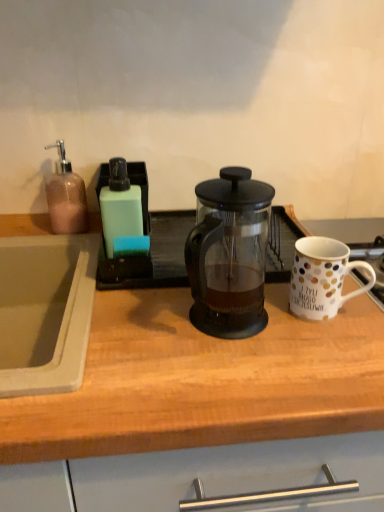
Question: Is white polka dot ceramic mug at right bigger or smaller than transparent glass french press at center?

Choices:
 (A) small
 (B) big

Answer: (A)

Question: In the image, is white polka dot ceramic mug at right positioned in front of or behind transparent glass french press at center?

Choices:
 (A) behind
 (B) front

Answer: (A)

Question: Considering the real-world distances, which object is farthest from the transparent glass french press at center?

Choices:
 (A) white polka dot ceramic mug at right
 (B) transparent glass french press at center

Answer: (A)

Question: Based on their relative distances, which object is farther from the transparent glass french press at center?

Choices:
 (A) white polka dot ceramic mug at right
 (B) transparent glass french press at center

Answer: (A)